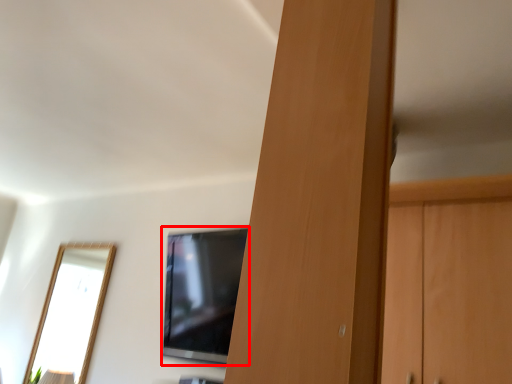
Question: From the image, what is the correct spatial relationship of television (annotated by the red box) in relation to door?

Choices:
 (A) left
 (B) right

Answer: (A)